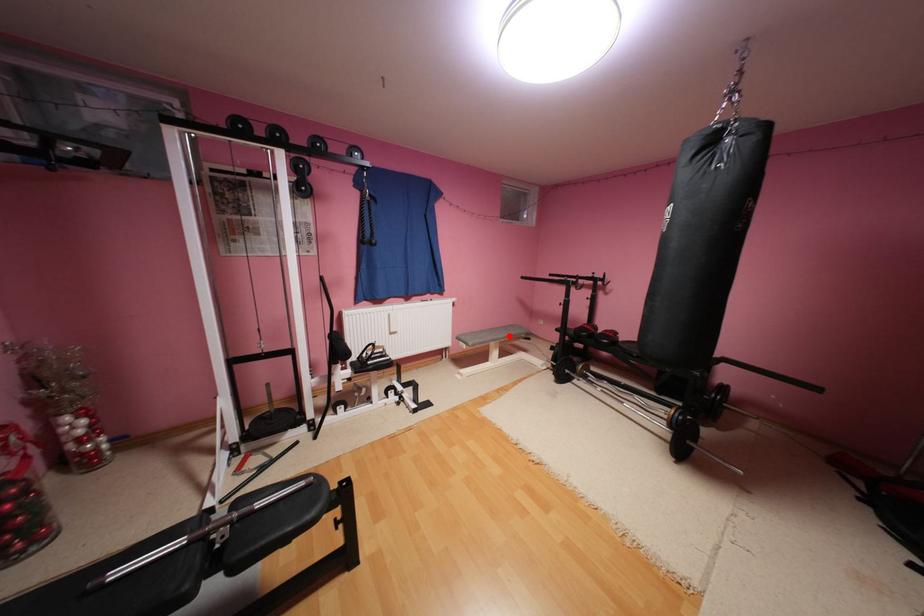
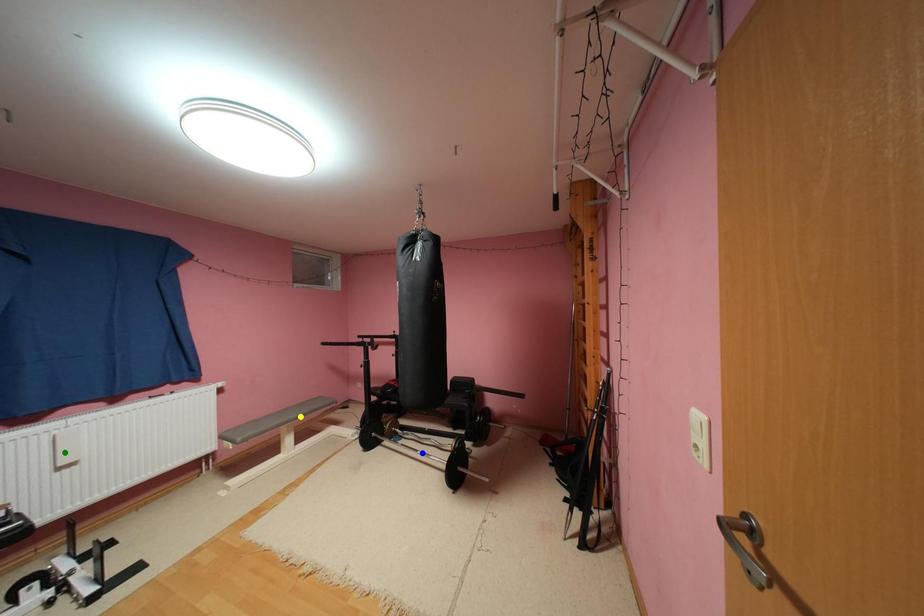
Question: I am providing you with two images of the same scene from different viewpoints. A red point is marked on the first image. You are given multiple points on the second image. Can you choose the point in image 2 that corresponds to the point in image 1?

Choices:
 (A) green point
 (B) yellow point
 (C) blue point

Answer: (B)